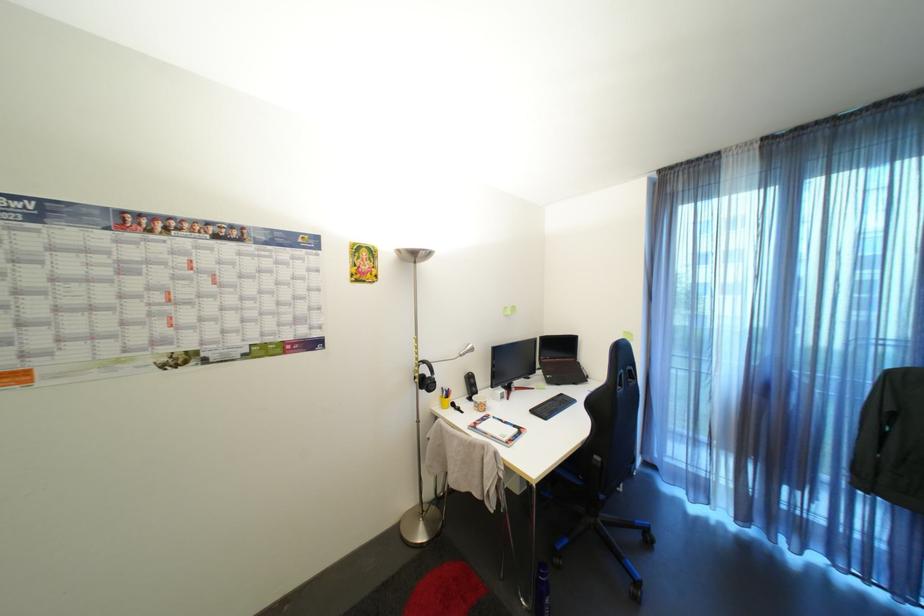
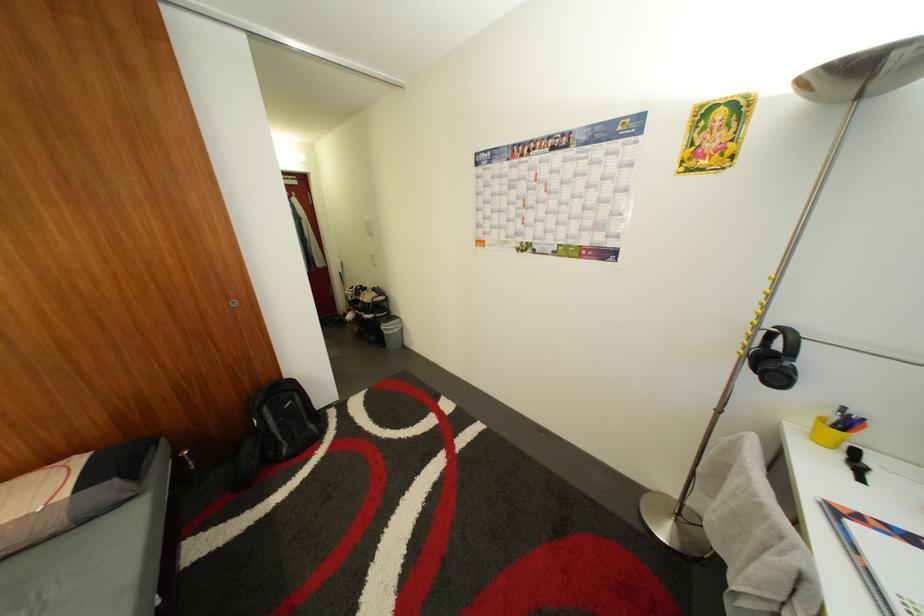
First-person continuous shooting, in which direction is the camera rotating?

The camera rotated toward left-down.